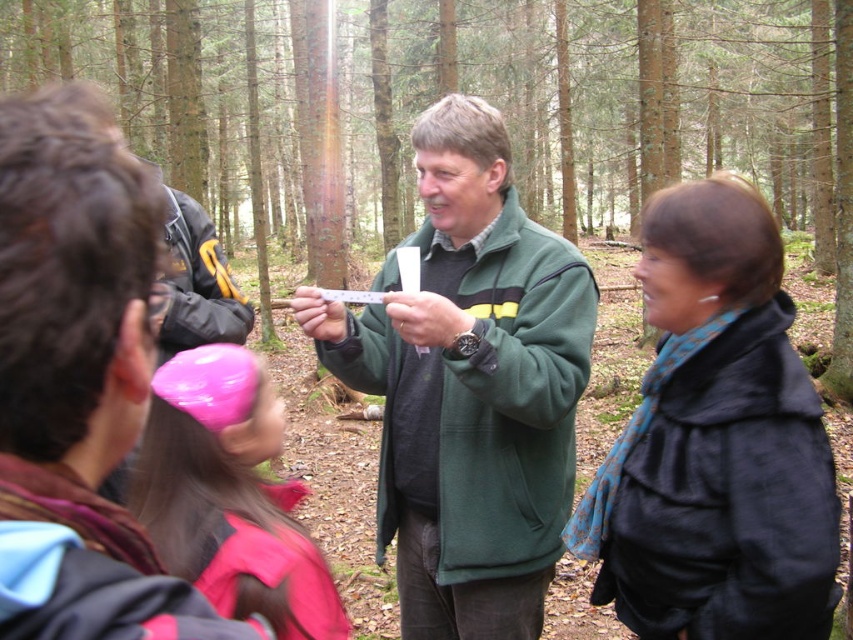
Question: Does black matte coat at center have a greater width compared to pink plastic magnifying glass at upper left?

Choices:
 (A) no
 (B) yes

Answer: (B)

Question: Which point is farther to the camera?

Choices:
 (A) (200, 630)
 (B) (544, 161)

Answer: (B)

Question: Does black matte coat at center have a smaller size compared to pink plastic magnifying glass at upper left?

Choices:
 (A) no
 (B) yes

Answer: (A)

Question: Which point is farther from the camera taking this photo?

Choices:
 (A) (440, 284)
 (B) (619, 106)
 (C) (120, 161)
 (D) (256, 490)

Answer: (B)

Question: Which point is closer to the camera?

Choices:
 (A) green matte jacket at center
 (B) green matte sweater at center

Answer: (B)

Question: Is green matte jacket at center further to the viewer compared to pink plastic magnifying glass at center?

Choices:
 (A) yes
 (B) no

Answer: (A)